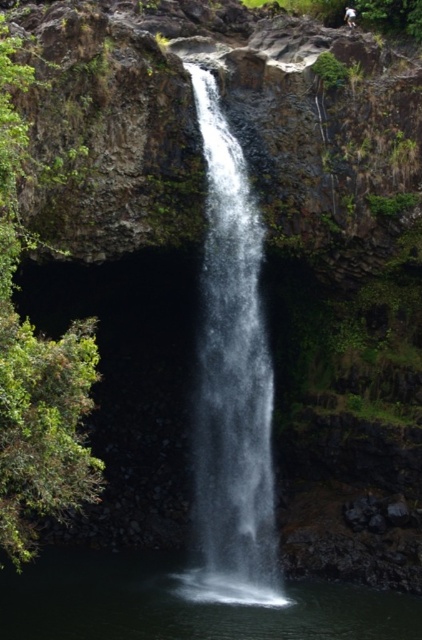
Question: Does clear water at center appear on the left side of white frothy water at center?

Choices:
 (A) yes
 (B) no

Answer: (B)

Question: Which object appears closest to the camera in this image?

Choices:
 (A) white frothy water at center
 (B) white cotton shirt at center
 (C) clear water at center

Answer: (A)

Question: Is clear water at center wider than white cotton shirt at center?

Choices:
 (A) yes
 (B) no

Answer: (A)

Question: Which object appears closest to the camera in this image?

Choices:
 (A) clear water at center
 (B) white frothy water at center

Answer: (B)

Question: Among these objects, which one is farthest from the camera?

Choices:
 (A) white frothy water at center
 (B) clear water at center
 (C) white cotton shirt at center

Answer: (C)

Question: Is clear water at center to the left of white frothy water at center from the viewer's perspective?

Choices:
 (A) yes
 (B) no

Answer: (B)